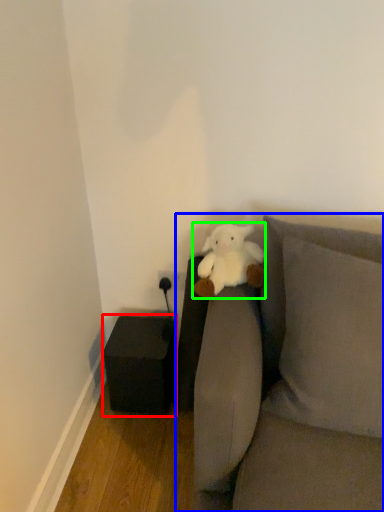
Question: Which object is positioned farthest from furniture (highlighted by a red box)? Select from studio couch (highlighted by a blue box) and teddy bear (highlighted by a green box).

Choices:
 (A) studio couch
 (B) teddy bear

Answer: (A)